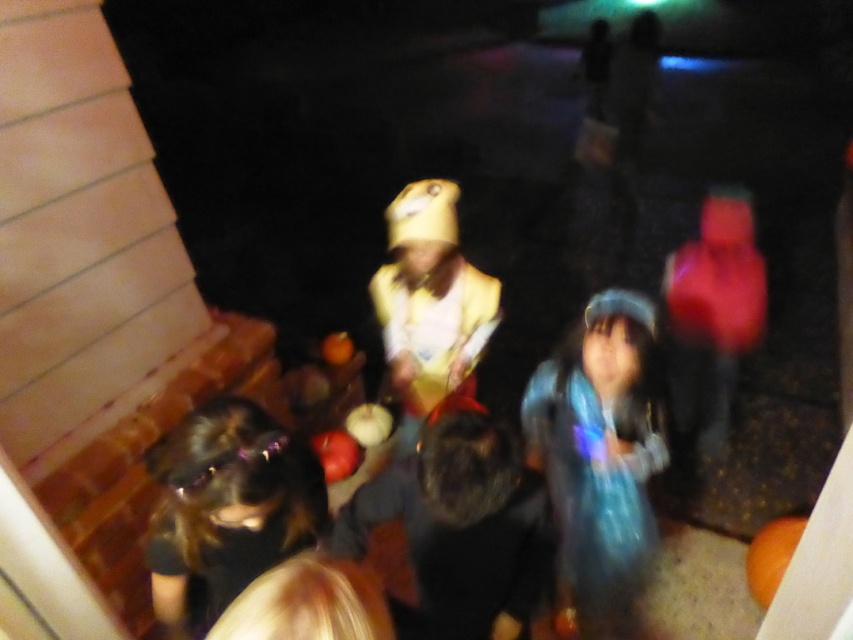
Can you confirm if black furry dog at center is thinner than black shiny hair at lower left?

No, black furry dog at center is not thinner than black shiny hair at lower left.

Which is below, black furry dog at center or black shiny hair at lower left?

black furry dog at center

This screenshot has width=853, height=640. What do you see at coordinates (459, 528) in the screenshot?
I see `black furry dog at center` at bounding box center [459, 528].

This screenshot has height=640, width=853. What are the coordinates of `black furry dog at center` in the screenshot? It's located at pos(459,528).

Who is shorter, translucent blue dress at center or black shiny hair at lower left?

black shiny hair at lower left

Is the position of translucent blue dress at center less distant than that of black shiny hair at lower left?

No, translucent blue dress at center is behind black shiny hair at lower left.

Identify the location of translucent blue dress at center. (599, 452).

Based on the photo, who is more distant from viewer, (486, 524) or (462, 317)?

The point (462, 317) is behind.

Is point (454, 632) positioned after point (398, 362)?

No, (454, 632) is closer to viewer.

What do you see at coordinates (459, 528) in the screenshot? Image resolution: width=853 pixels, height=640 pixels. I see `black furry dog at center` at bounding box center [459, 528].

Locate an element on the screen. black furry dog at center is located at coordinates (459, 528).